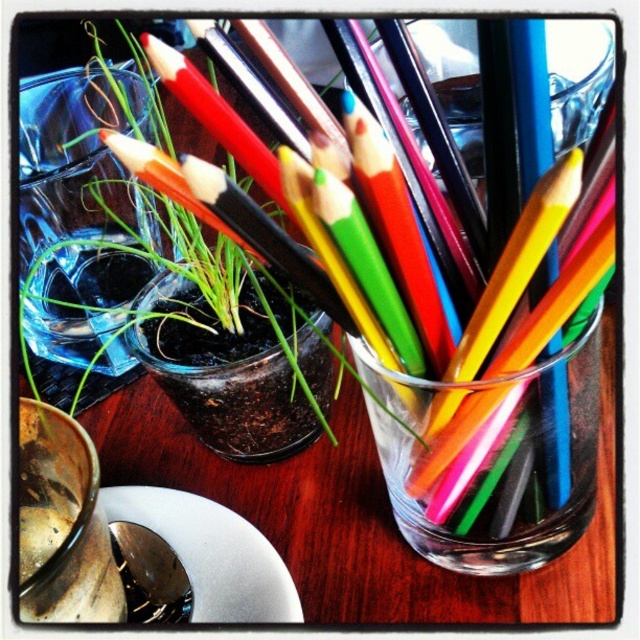
You are arranging items on a wooden table. You have a transparent glass vase at upper left and a white glossy plate at lower left. Based on their positions, which item is closer to the edge of the table?

The transparent glass vase at upper left is closer to the edge of the table because it is positioned above the white glossy plate at lower left.

You are an interior designer arranging items on a table. You have a transparent glass vase at upper left and a potted plant in another transparent glass container. Based on their positions, which item is closer to the upper edge of the table?

The transparent glass vase at upper left is closer to the upper edge of the table since its position is at point (76, 237), indicating it is higher up on the table compared to the potted plant in another transparent glass container.

You are arranging items on a table and need to place a decorative item that requires a wider base. You have a transparent glass vase at upper left and a white glossy plate at lower left. Which item should you choose to ensure stability?

The white glossy plate at lower left has a wider base than the transparent glass vase at upper left, so it would provide better stability for the decorative item.